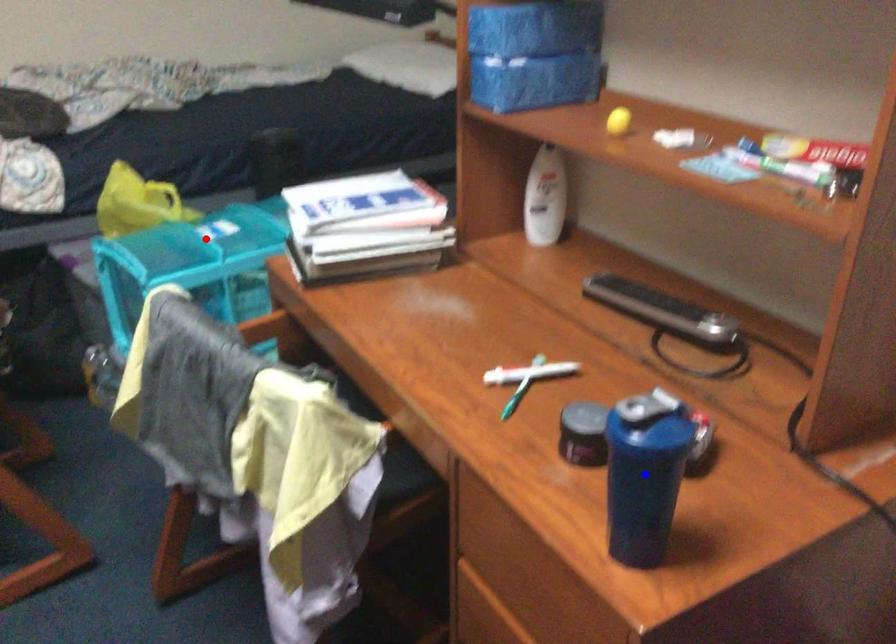
Question: In the image, two points are highlighted. Which point is nearer to the camera? Reply with the corresponding letter.

Choices:
 (A) blue point
 (B) red point

Answer: (A)